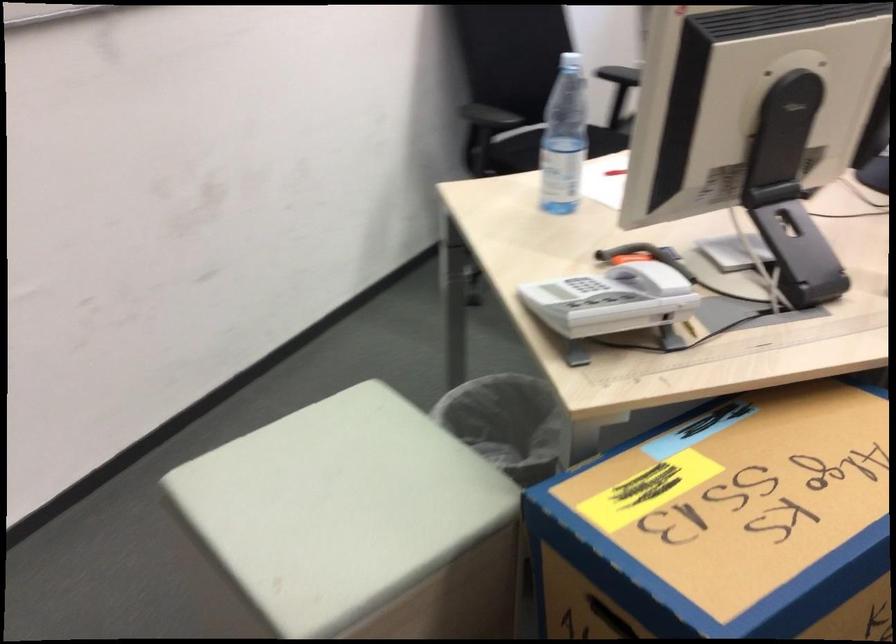
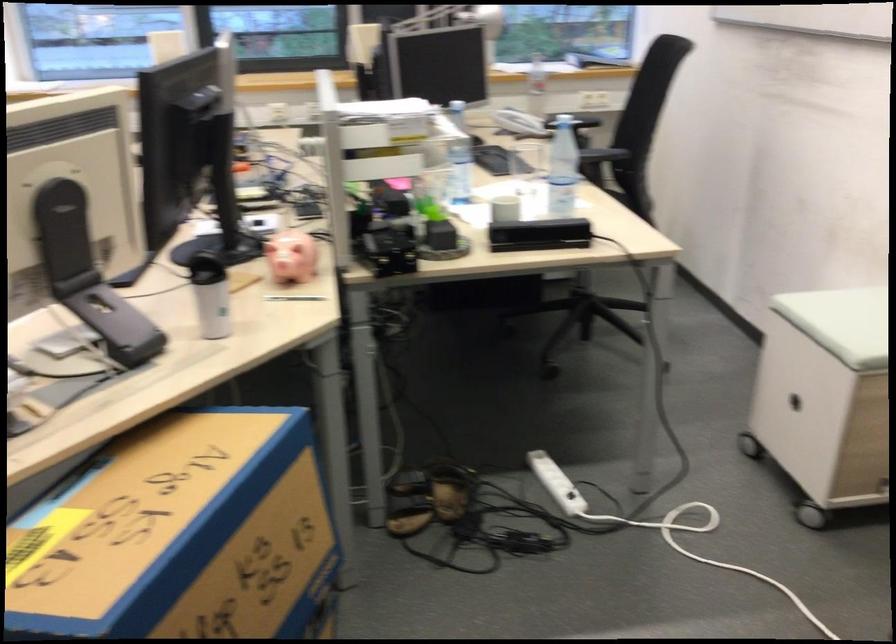
The point at [778,182] is marked in the first image. Where is the corresponding point in the second image?

(88, 275)